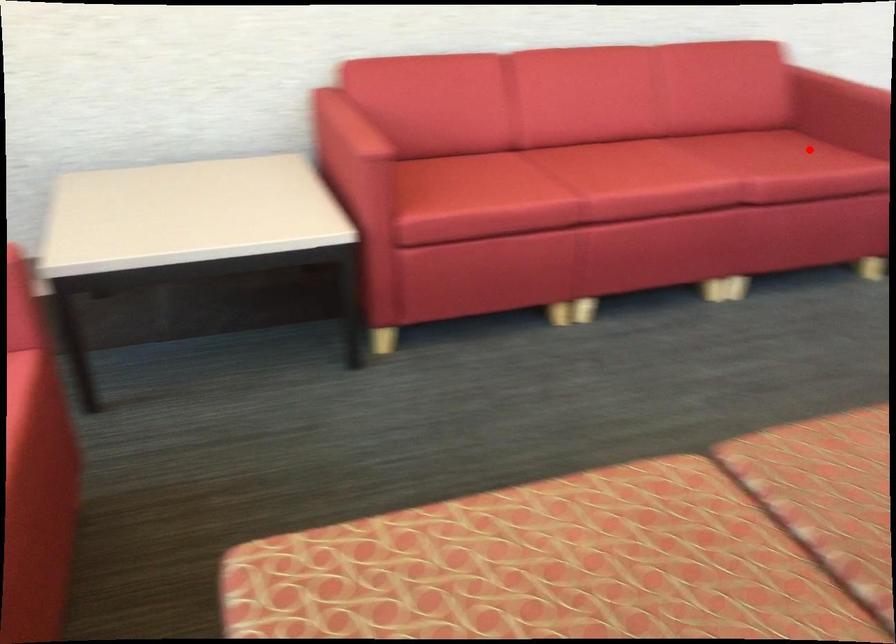
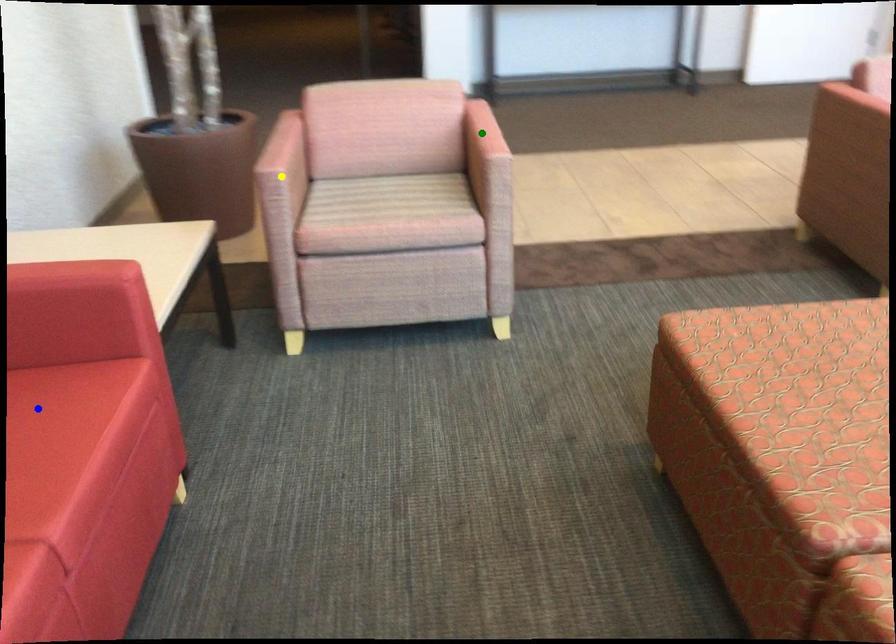
Question: I am providing you with two images of the same scene from different viewpoints. A red point is marked on the first image. You are given multiple points on the second image. Can you choose the point in image 2 that corresponds to the point in image 1?

Choices:
 (A) blue point
 (B) yellow point
 (C) green point

Answer: (A)